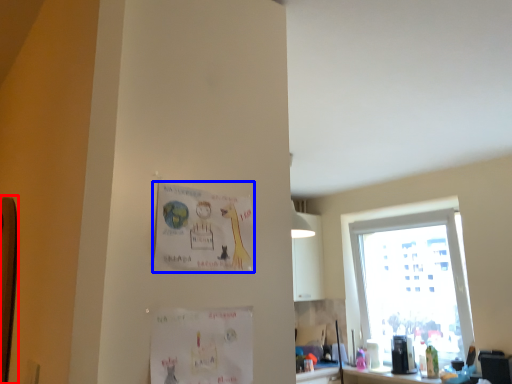
Question: Among these objects, which one is farthest to the camera, bulletin board (highlighted by a red box) or postcard (highlighted by a blue box)?

Choices:
 (A) bulletin board
 (B) postcard

Answer: (A)